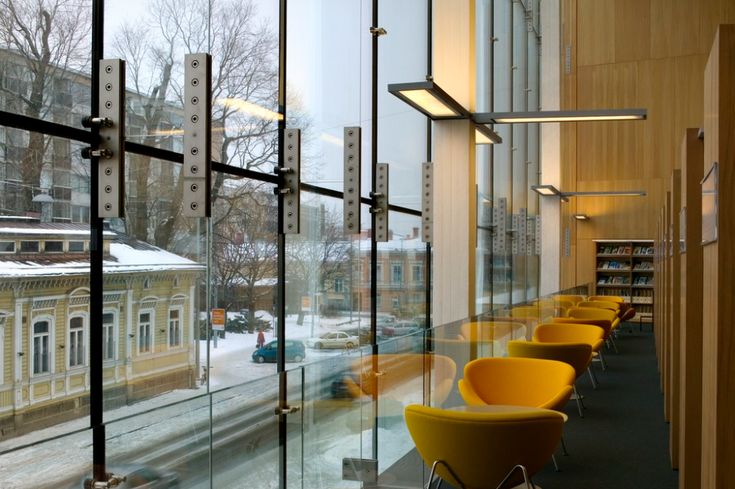
The height and width of the screenshot is (489, 735). What are the coordinates of `book case` in the screenshot? It's located at (709, 301), (688, 301), (673, 257), (663, 279), (656, 299), (614, 260).